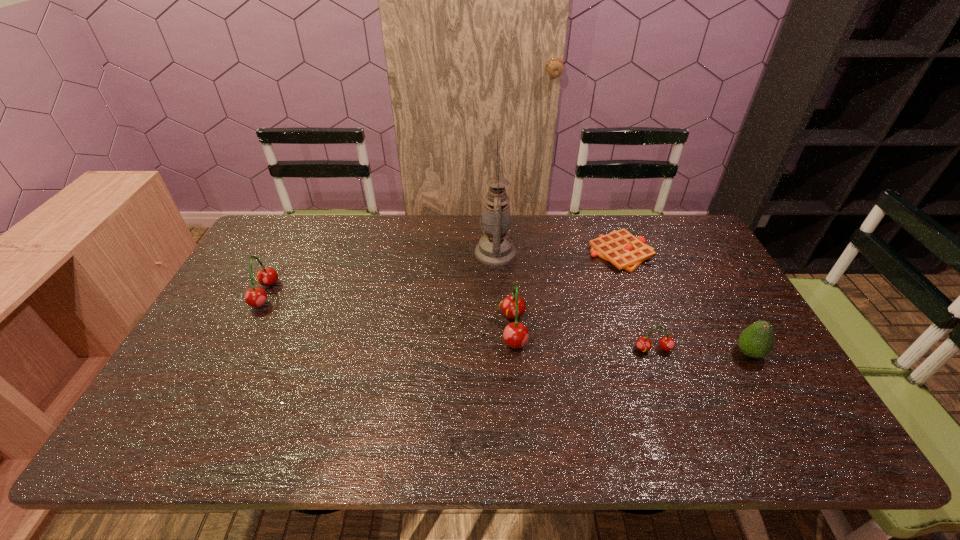
Where is `vacant space that satisfies the following two spatial constraints: 1. with stems pointing upwards on the avocado; 2. on the left side of the shortest cherry`? The height and width of the screenshot is (540, 960). vacant space that satisfies the following two spatial constraints: 1. with stems pointing upwards on the avocado; 2. on the left side of the shortest cherry is located at coordinates (655, 353).

Identify the location of free spot that satisfies the following two spatial constraints: 1. with stems pointing upwards on the avocado; 2. on the left side of the third tallest object. The height and width of the screenshot is (540, 960). (234, 353).

In order to click on free location that satisfies the following two spatial constraints: 1. with stems pointing upwards on the avocado; 2. on the left side of the rightmost cherry in this screenshot , I will do `click(655, 353)`.